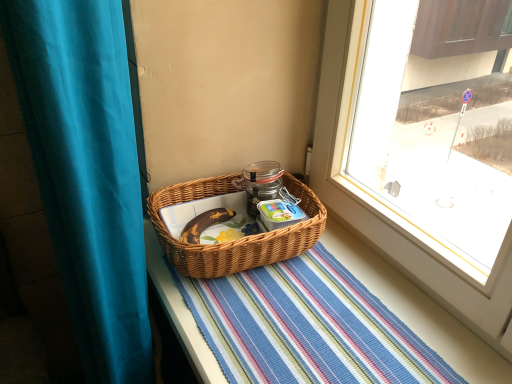
Where is `vacant space in front of woven brown picnic basket at center`? This screenshot has height=384, width=512. vacant space in front of woven brown picnic basket at center is located at coordinates (270, 330).